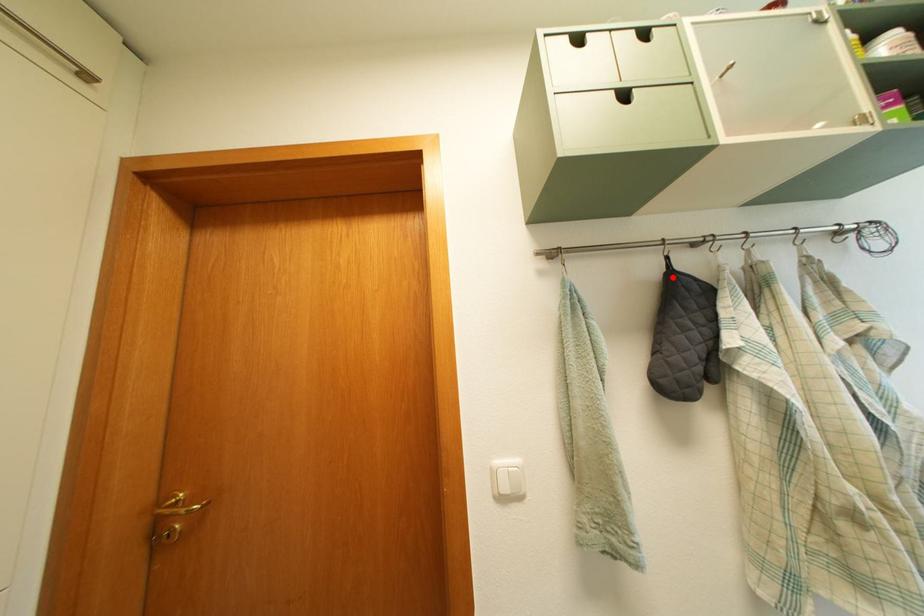
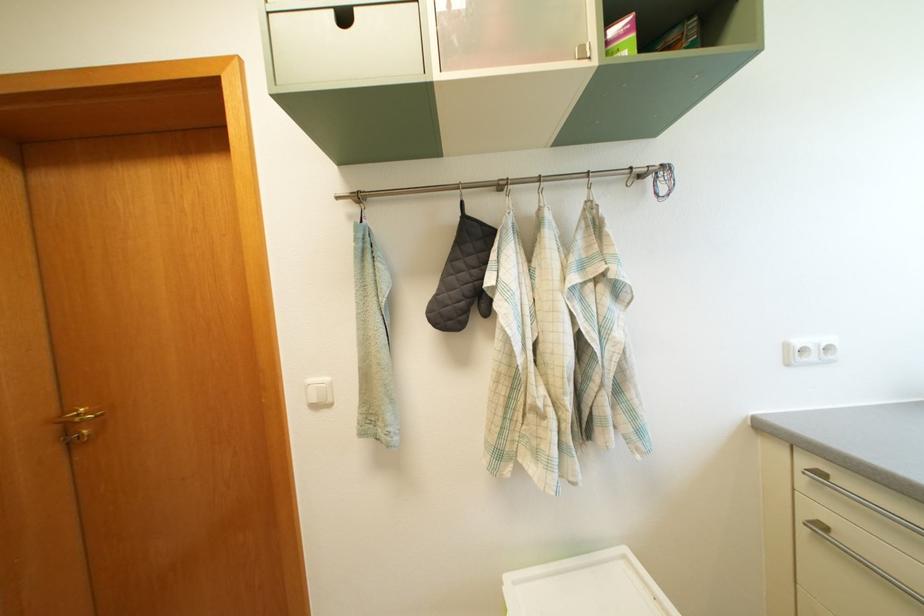
Find the pixel in the second image that matches the highlighted location in the first image.

(468, 222)